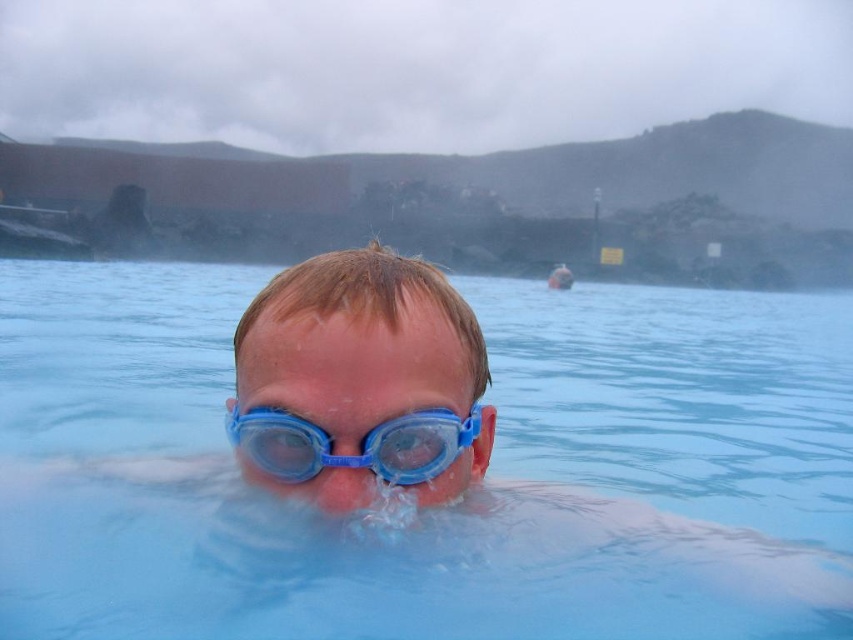
The width and height of the screenshot is (853, 640). What do you see at coordinates (287, 506) in the screenshot?
I see `transparent blue water at center` at bounding box center [287, 506].

Does point (351, 577) come farther from viewer compared to point (310, 452)?

Yes, point (351, 577) is farther from viewer.

Where is `transparent blue water at center`? This screenshot has width=853, height=640. transparent blue water at center is located at coordinates (287, 506).